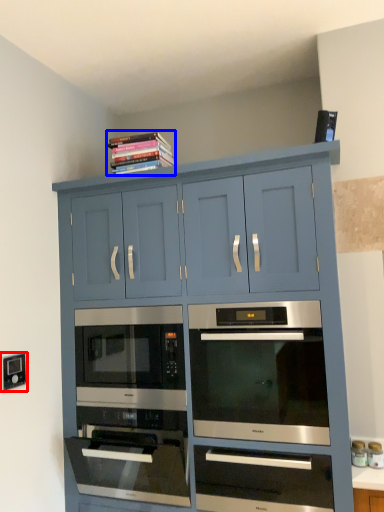
Question: Which of the following is the farthest to the observer, electric outlet (highlighted by a red box) or book (highlighted by a blue box)?

Choices:
 (A) electric outlet
 (B) book

Answer: (B)